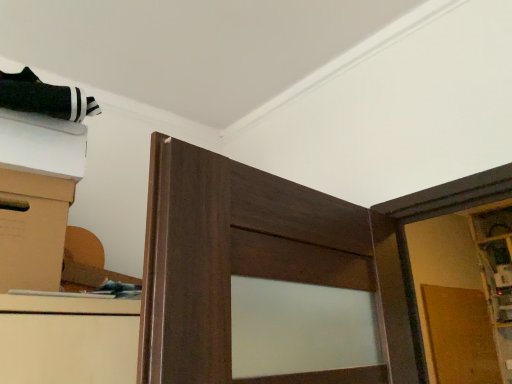
Question: Looking at their shapes, would you say brown cardboard box at left is wider or thinner than matte brown cabinet at right?

Choices:
 (A) thin
 (B) wide

Answer: (B)

Question: Does point (22, 269) appear closer or farther from the camera than point (503, 284)?

Choices:
 (A) farther
 (B) closer

Answer: (B)

Question: Considering their positions, is brown cardboard box at left located in front of or behind matte brown cabinet at right?

Choices:
 (A) front
 (B) behind

Answer: (A)

Question: Is matte brown cabinet at right inside the boundaries of brown cardboard box at left, or outside?

Choices:
 (A) inside
 (B) outside

Answer: (B)

Question: In terms of width, does matte brown cabinet at right look wider or thinner when compared to brown cardboard box at left?

Choices:
 (A) thin
 (B) wide

Answer: (A)

Question: Is matte brown cabinet at right bigger or smaller than brown cardboard box at left?

Choices:
 (A) small
 (B) big

Answer: (B)

Question: From the image's perspective, is matte brown cabinet at right above or below brown cardboard box at left?

Choices:
 (A) above
 (B) below

Answer: (B)